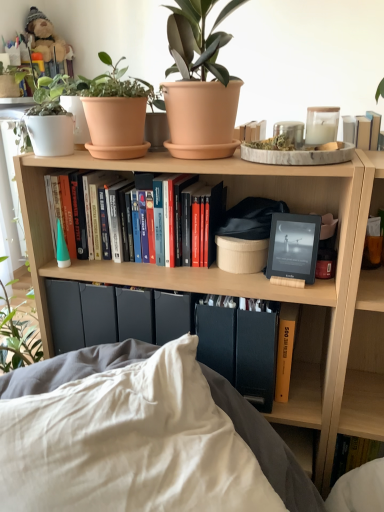
Find the location of a particular element. This screenshot has width=384, height=512. hardcover books at center, placed as the 2th book when sorted from right to left is located at coordinates (210, 225).

Find the location of a particular element. white soft pillow at lower center is located at coordinates (129, 443).

The image size is (384, 512). What do you see at coordinates (129, 443) in the screenshot? I see `white soft pillow at lower center` at bounding box center [129, 443].

The image size is (384, 512). I want to click on terracotta clay pot at upper center, so click(x=116, y=127).

Describe the element at coordinates (200, 83) in the screenshot. I see `terracotta pot at upper center` at that location.

Where is `hardcover books at center, placed as the first book when sorted from left to right`? This screenshot has width=384, height=512. hardcover books at center, placed as the first book when sorted from left to right is located at coordinates (210, 225).

The height and width of the screenshot is (512, 384). In order to click on houseplant above the wooden bookshelf at center (from a real-world perspective) in this screenshot , I will do `click(200, 83)`.

Are wooden bookshelf at center and terracotta pot at upper center beside each other?

No, wooden bookshelf at center is not beside terracotta pot at upper center.

Considering the positions of points (375, 423) and (226, 6), is point (375, 423) closer to camera compared to point (226, 6)?

Yes, it is.

Does wooden bookshelf at center have a greater height compared to terracotta pot at upper center?

Indeed, wooden bookshelf at center has a greater height compared to terracotta pot at upper center.

Is hardcover books at center, the 2th book ordered from the bottom, directly adjacent to yellow matte book at lower right, which ranks as the second book in top-to-bottom order?

No, hardcover books at center, the 2th book ordered from the bottom, is not in contact with yellow matte book at lower right, which ranks as the second book in top-to-bottom order.

Is hardcover books at center, placed as the first book when sorted from left to right, in front of or behind yellow matte book at lower right, which is the 1th book from bottom to top, in the image?

Clearly, hardcover books at center, placed as the first book when sorted from left to right, is in front of yellow matte book at lower right, which is the 1th book from bottom to top.

Considering the relative sizes of hardcover books at center, the 2th book ordered from the bottom, and yellow matte book at lower right, which ranks as the second book in top-to-bottom order, in the image provided, is hardcover books at center, the 2th book ordered from the bottom, wider than yellow matte book at lower right, which ranks as the second book in top-to-bottom order,?

Yes.

Would you say hardcover books at center, placed as the first book when sorted from left to right, is inside or outside yellow matte book at lower right, which ranks as the second book in top-to-bottom order?

hardcover books at center, placed as the first book when sorted from left to right, is spatially situated outside yellow matte book at lower right, which ranks as the second book in top-to-bottom order.

Which of these two, yellow matte book at lower right, which ranks as the second book in top-to-bottom order, or matte black e-reader at center, is thinner?

With smaller width is matte black e-reader at center.

Considering the positions of objects yellow matte book at lower right, which is the 1th book from bottom to top, and matte black e-reader at center in the image provided, who is in front, yellow matte book at lower right, which is the 1th book from bottom to top, or matte black e-reader at center?

matte black e-reader at center is closer to the camera.

Which point is more distant from viewer, (291, 319) or (304, 228)?

The point (291, 319) is more distant.

Looking at the image, does terracotta pot at upper center seem bigger or smaller compared to black matte book at center?

In the image, terracotta pot at upper center appears to be larger than black matte book at center.

How much distance is there between terracotta pot at upper center and black matte book at center?

terracotta pot at upper center and black matte book at center are 21.96 inches apart.

Which is in front, point (199, 12) or point (274, 358)?

Point (199, 12)

From a real-world perspective, is terracotta pot at upper center physically located above or below black matte book at center?

terracotta pot at upper center is above black matte book at center.

Is terracotta pot at upper center at the back of white soft pillow at lower center?

white soft pillow at lower center does not have its back to terracotta pot at upper center.

From the image's perspective, who appears lower, white soft pillow at lower center or terracotta pot at upper center?

white soft pillow at lower center appears lower in the image.

Is white soft pillow at lower center taller than terracotta pot at upper center?

Correct, white soft pillow at lower center is much taller as terracotta pot at upper center.

Which is nearer, (10, 422) or (192, 36)?

Point (10, 422) appears to be closer to the viewer than point (192, 36).

Is terracotta clay pot at upper center oriented away from matte black e-reader at center?

No, terracotta clay pot at upper center's orientation is not away from matte black e-reader at center.

Considering the points (141, 133) and (320, 224), which point is in front, point (141, 133) or point (320, 224)?

The point (141, 133) is closer to the camera.

Is terracotta clay pot at upper center positioned before matte black e-reader at center?

Yes, the depth of terracotta clay pot at upper center is less than that of matte black e-reader at center.

Is teddy bear at upper left in front of or behind matte black e-reader at center in the image?

Visually, teddy bear at upper left is located behind matte black e-reader at center.

Is matte black e-reader at center a part of teddy bear at upper left?

No.

Who is bigger, teddy bear at upper left or matte black e-reader at center?

Bigger between the two is teddy bear at upper left.

Which of these two, teddy bear at upper left or matte black e-reader at center, is thinner?

matte black e-reader at center.

I want to click on bookcase that appears on the right of terracotta pot at upper center, so click(x=265, y=284).

Where is `book below the hardcover books at center, placed as the first book when sorted from left to right (from a real-world perspective)`? Image resolution: width=384 pixels, height=512 pixels. book below the hardcover books at center, placed as the first book when sorted from left to right (from a real-world perspective) is located at coordinates (285, 348).

When comparing their distances from matte black e-reader at center, does terracotta pot at upper center or black matte book at center seem closer?

Based on the image, black matte book at center appears to be nearer to matte black e-reader at center.

Which object lies further to the anchor point hardcover books at center, placed as the 2th book when sorted from right to left, terracotta clay pot at upper center or terracotta pot at upper center?

Based on the image, terracotta pot at upper center appears to be further to hardcover books at center, placed as the 2th book when sorted from right to left.

Based on their spatial positions, is terracotta clay pot at upper center or black matte book at center further from white soft pillow at lower center?

Based on the image, terracotta clay pot at upper center appears to be further to white soft pillow at lower center.

When comparing their distances from white soft pillow at lower center, does hardcover books at center, placed as the first book when sorted from left to right, or terracotta clay pot at upper center seem closer?

Based on the image, hardcover books at center, placed as the first book when sorted from left to right, appears to be nearer to white soft pillow at lower center.

From the image, which object appears to be nearer to teddy bear at upper left, white soft pillow at lower center or hardcover books at center, the 2th book ordered from the bottom?

Among the two, hardcover books at center, the 2th book ordered from the bottom, is located nearer to teddy bear at upper left.

Estimate the real-world distances between objects in this image. Which object is further from terracotta pot at upper center, teddy bear at upper left or wooden bookshelf at center?

teddy bear at upper left.

From the image, which object appears to be nearer to wooden bookshelf at center, teddy bear at upper left or white soft pillow at lower center?

white soft pillow at lower center.

When comparing their distances from teddy bear at upper left, does yellow matte book at lower right, which ranks as the second book in top-to-bottom order, or matte black e-reader at center seem closer?

Among the two, matte black e-reader at center is located nearer to teddy bear at upper left.

Identify the location of bookcase between terracotta pot at upper center and white soft pillow at lower center vertically. (265, 284).

You are a GUI agent. You are given a task and a screenshot of the screen. Output one action in this format:
    pyautogui.click(x=<x>, y=<y>)
    Task: Click on the picture frame between terracotta pot at upper center and yellow matte book at lower right, the 2th book in the left-to-right sequence, in the up-down direction
    The width and height of the screenshot is (384, 512).
    Given the screenshot: What is the action you would take?
    pyautogui.click(x=293, y=246)

Locate an element on the screen. picture frame between white soft pillow at lower center and yellow matte book at lower right, which ranks as the second book in top-to-bottom order, in the front-back direction is located at coordinates (293, 246).

Identify the location of paperback book located between white soft pillow at lower center and teddy bear at upper left in the depth direction. (256, 357).